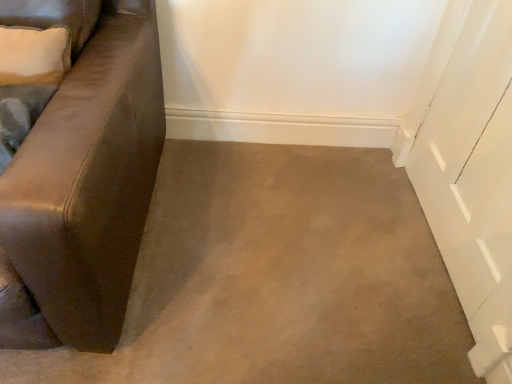
Locate an element on the screen. brown leather couch at left is located at coordinates (277, 277).

In order to face brown leather couch at left, should I rotate leftwards or rightwards?

Rotate your view left by about 2.187°.

The width and height of the screenshot is (512, 384). Describe the element at coordinates (277, 277) in the screenshot. I see `brown leather couch at left` at that location.

The height and width of the screenshot is (384, 512). I want to click on brown leather couch at left, so click(277, 277).